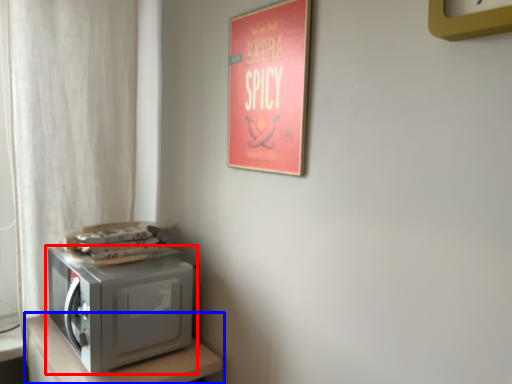
Question: Which of the following is the closest to the observer, home appliance (highlighted by a red box) or furniture (highlighted by a blue box)?

Choices:
 (A) home appliance
 (B) furniture

Answer: (B)